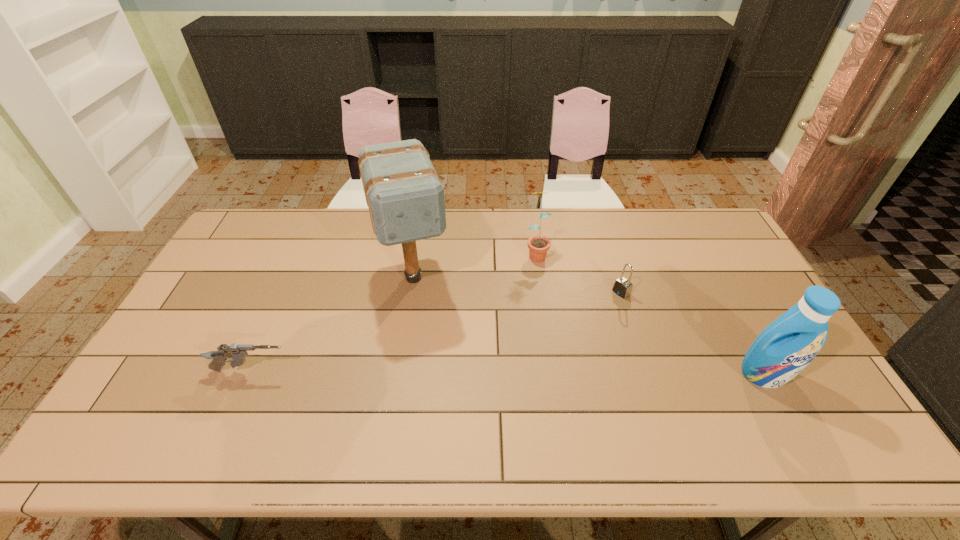
I want to click on gun, so click(x=237, y=352).

Where is `the fourth shortest object`? The width and height of the screenshot is (960, 540). the fourth shortest object is located at coordinates (784, 348).

Locate an element on the screen. This screenshot has height=540, width=960. detergent is located at coordinates (784, 348).

Where is `padlock`? padlock is located at coordinates (622, 287).

At what (x,y) coordinates should I click in order to perform the action: click on sunflower. Please return your answer as a coordinate pair (x, y). The width and height of the screenshot is (960, 540). Looking at the image, I should click on [x=538, y=245].

Where is `the third object from left to right`? the third object from left to right is located at coordinates [x=538, y=245].

I want to click on mallet, so click(405, 196).

This screenshot has height=540, width=960. Find the location of `the second object from left to right`. the second object from left to right is located at coordinates (405, 196).

The width and height of the screenshot is (960, 540). Find the location of `free space located at the barrel of the leftmost object`. free space located at the barrel of the leftmost object is located at coordinates (420, 371).

Image resolution: width=960 pixels, height=540 pixels. What are the coordinates of `vacant space located on the front-facing side of the fourth shortest object` in the screenshot? It's located at click(x=785, y=413).